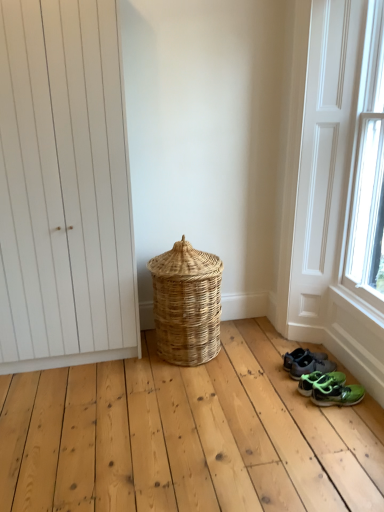
The height and width of the screenshot is (512, 384). What are the coordinates of `natural woven basket at center` in the screenshot? It's located at (186, 304).

The image size is (384, 512). In order to click on green rubber sandals at lower right, the second footwear from the front in this screenshot , I will do `click(323, 381)`.

How much space does green fabric sneakers at lower right, placed as the third footwear when sorted from front to back, occupy horizontally?

The width of green fabric sneakers at lower right, placed as the third footwear when sorted from front to back, is 13.20 inches.

Identify the location of green fabric sneakers at lower right, which ranks as the 1th footwear in back-to-front order. (301, 356).

At what (x,y) coordinates should I click in order to perform the action: click on green matte sneakers at lower right, marked as the third footwear in a back-to-front arrangement. Please return your answer as a coordinate pair (x, y). This screenshot has width=384, height=512. Looking at the image, I should click on (336, 394).

Is point (320, 395) positioned before point (35, 152)?

No, it is behind (35, 152).

What's the angular difference between green matte sneakers at lower right, which appears as the 1th footwear when viewed from the front, and white matte door at left's facing directions?

green matte sneakers at lower right, which appears as the 1th footwear when viewed from the front, and white matte door at left are facing 91.8 degrees away from each other.

Do you think green matte sneakers at lower right, which appears as the 1th footwear when viewed from the front, is within white matte door at left, or outside of it?

green matte sneakers at lower right, which appears as the 1th footwear when viewed from the front, is not enclosed by white matte door at left.

Does green matte sneakers at lower right, which appears as the 1th footwear when viewed from the front, have a lesser width compared to white matte door at left?

Yes, green matte sneakers at lower right, which appears as the 1th footwear when viewed from the front, is thinner than white matte door at left.

Does green matte sneakers at lower right, marked as the third footwear in a back-to-front arrangement, appear on the left side of white wood screen door at lower right?

Incorrect, green matte sneakers at lower right, marked as the third footwear in a back-to-front arrangement, is not on the left side of white wood screen door at lower right.

From a real-world perspective, is green matte sneakers at lower right, which appears as the 1th footwear when viewed from the front, on white wood screen door at lower right?

No, from a real-world perspective, green matte sneakers at lower right, which appears as the 1th footwear when viewed from the front, is not above white wood screen door at lower right.

Which is behind, green matte sneakers at lower right, which appears as the 1th footwear when viewed from the front, or white wood screen door at lower right?

green matte sneakers at lower right, which appears as the 1th footwear when viewed from the front, is behind.

Which is behind, point (353, 404) or point (333, 221)?

The point (333, 221) is behind.

How different are the orientations of green matte sneakers at lower right, marked as the third footwear in a back-to-front arrangement, and green rubber sandals at lower right, the second footwear from the front, in degrees?

7.41 degrees separate the facing orientations of green matte sneakers at lower right, marked as the third footwear in a back-to-front arrangement, and green rubber sandals at lower right, the second footwear from the front.

Who is smaller, green matte sneakers at lower right, marked as the third footwear in a back-to-front arrangement, or green rubber sandals at lower right, arranged as the 2th footwear when viewed from the back?

With smaller size is green matte sneakers at lower right, marked as the third footwear in a back-to-front arrangement.

From the image's perspective, who appears lower, green matte sneakers at lower right, marked as the third footwear in a back-to-front arrangement, or green rubber sandals at lower right, the second footwear from the front?

green matte sneakers at lower right, marked as the third footwear in a back-to-front arrangement, from the image's perspective.

Looking at this image, is green fabric sneakers at lower right, placed as the third footwear when sorted from front to back, next to natural woven basket at center and touching it?

green fabric sneakers at lower right, placed as the third footwear when sorted from front to back, and natural woven basket at center are not in contact.

From the image's perspective, between green fabric sneakers at lower right, placed as the third footwear when sorted from front to back, and natural woven basket at center, which one is located above?

natural woven basket at center.

Locate an element on the screen. The width and height of the screenshot is (384, 512). the 1st footwear located beneath the natural woven basket at center (from a real-world perspective) is located at coordinates (301, 356).

Considering the sizes of green fabric sneakers at lower right, which ranks as the 1th footwear in back-to-front order, and natural woven basket at center in the image, is green fabric sneakers at lower right, which ranks as the 1th footwear in back-to-front order, taller or shorter than natural woven basket at center?

green fabric sneakers at lower right, which ranks as the 1th footwear in back-to-front order, is shorter than natural woven basket at center.

How different are the orientations of green matte sneakers at lower right, marked as the third footwear in a back-to-front arrangement, and green fabric sneakers at lower right, which ranks as the 1th footwear in back-to-front order, in degrees?

There is a 7.41-degree angle between the facing directions of green matte sneakers at lower right, marked as the third footwear in a back-to-front arrangement, and green fabric sneakers at lower right, which ranks as the 1th footwear in back-to-front order.

In the scene shown: Which is more to the right, green matte sneakers at lower right, which appears as the 1th footwear when viewed from the front, or green fabric sneakers at lower right, placed as the third footwear when sorted from front to back?

green matte sneakers at lower right, which appears as the 1th footwear when viewed from the front, is more to the right.

Is green matte sneakers at lower right, marked as the third footwear in a back-to-front arrangement, thinner than green fabric sneakers at lower right, which ranks as the 1th footwear in back-to-front order?

Yes.

Is green matte sneakers at lower right, marked as the third footwear in a back-to-front arrangement, facing away from green fabric sneakers at lower right, placed as the third footwear when sorted from front to back?

green matte sneakers at lower right, marked as the third footwear in a back-to-front arrangement, is not turned away from green fabric sneakers at lower right, placed as the third footwear when sorted from front to back.

From the picture: How many degrees apart are the facing directions of white wood screen door at lower right and natural woven basket at center?

The angular difference between white wood screen door at lower right and natural woven basket at center is 89.3 degrees.

Between point (332, 58) and point (154, 275), which one is positioned in front?

The point (332, 58) is in front.

I want to click on basket on the left of the white wood screen door at lower right, so click(x=186, y=304).

Who is bigger, white wood screen door at lower right or natural woven basket at center?

white wood screen door at lower right.

From the image's perspective, would you say green fabric sneakers at lower right, placed as the third footwear when sorted from front to back, is positioned over green rubber sandals at lower right, arranged as the 2th footwear when viewed from the back?

Correct, green fabric sneakers at lower right, placed as the third footwear when sorted from front to back, appears higher than green rubber sandals at lower right, arranged as the 2th footwear when viewed from the back, in the image.

Does point (285, 362) lie in front of point (363, 390)?

No, it is not.

Can you confirm if green fabric sneakers at lower right, placed as the third footwear when sorted from front to back, is positioned to the left of green rubber sandals at lower right, the second footwear from the front?

Correct, you'll find green fabric sneakers at lower right, placed as the third footwear when sorted from front to back, to the left of green rubber sandals at lower right, the second footwear from the front.

Where is `door above the green matte sneakers at lower right, which appears as the 1th footwear when viewed from the front (from the image's perspective)`? door above the green matte sneakers at lower right, which appears as the 1th footwear when viewed from the front (from the image's perspective) is located at coordinates (64, 188).

Which footwear is the 1st one when counting from the back of the white wood screen door at lower right? Please provide its 2D coordinates.

[(336, 394)]

From the image, which object appears to be farther from green matte sneakers at lower right, marked as the third footwear in a back-to-front arrangement, natural woven basket at center or green rubber sandals at lower right, the second footwear from the front?

natural woven basket at center lies further to green matte sneakers at lower right, marked as the third footwear in a back-to-front arrangement, than the other object.

From the image, which object appears to be farther from green fabric sneakers at lower right, placed as the third footwear when sorted from front to back, white wood screen door at lower right or green matte sneakers at lower right, which appears as the 1th footwear when viewed from the front?

Based on the image, white wood screen door at lower right appears to be further to green fabric sneakers at lower right, placed as the third footwear when sorted from front to back.

Which object lies further to the anchor point green matte sneakers at lower right, which appears as the 1th footwear when viewed from the front, green rubber sandals at lower right, the second footwear from the front, or white wood screen door at lower right?

Among the two, white wood screen door at lower right is located further to green matte sneakers at lower right, which appears as the 1th footwear when viewed from the front.

Estimate the real-world distances between objects in this image. Which object is further from green fabric sneakers at lower right, which ranks as the 1th footwear in back-to-front order, white matte door at left or white wood screen door at lower right?

white matte door at left is further to green fabric sneakers at lower right, which ranks as the 1th footwear in back-to-front order.

Looking at the image, which one is located further to green matte sneakers at lower right, marked as the third footwear in a back-to-front arrangement, white wood screen door at lower right or white matte door at left?

white matte door at left is positioned further to the anchor green matte sneakers at lower right, marked as the third footwear in a back-to-front arrangement.

Looking at the image, which one is located further to white matte door at left, green rubber sandals at lower right, arranged as the 2th footwear when viewed from the back, or natural woven basket at center?

green rubber sandals at lower right, arranged as the 2th footwear when viewed from the back.

Looking at the image, which one is located closer to green matte sneakers at lower right, which appears as the 1th footwear when viewed from the front, natural woven basket at center or white matte door at left?

natural woven basket at center lies closer to green matte sneakers at lower right, which appears as the 1th footwear when viewed from the front, than the other object.

From the image, which object appears to be farther from natural woven basket at center, green fabric sneakers at lower right, which ranks as the 1th footwear in back-to-front order, or white wood screen door at lower right?

white wood screen door at lower right is positioned further to the anchor natural woven basket at center.

Locate an element on the screen. This screenshot has width=384, height=512. basket located between white matte door at left and green rubber sandals at lower right, the second footwear from the front, in the left-right direction is located at coordinates (186, 304).

This screenshot has width=384, height=512. Identify the location of basket between white matte door at left and green matte sneakers at lower right, marked as the third footwear in a back-to-front arrangement, from left to right. (186, 304).

You are a GUI agent. You are given a task and a screenshot of the screen. Output one action in this format:
    pyautogui.click(x=<x>, y=<y>)
    Task: Click on the screen door situated between white matte door at left and green matte sneakers at lower right, marked as the third footwear in a back-to-front arrangement, from left to right
    
    Given the screenshot: What is the action you would take?
    pyautogui.click(x=324, y=159)

Identify the location of footwear located between white matte door at left and white wood screen door at lower right in the left-right direction. (301, 356).